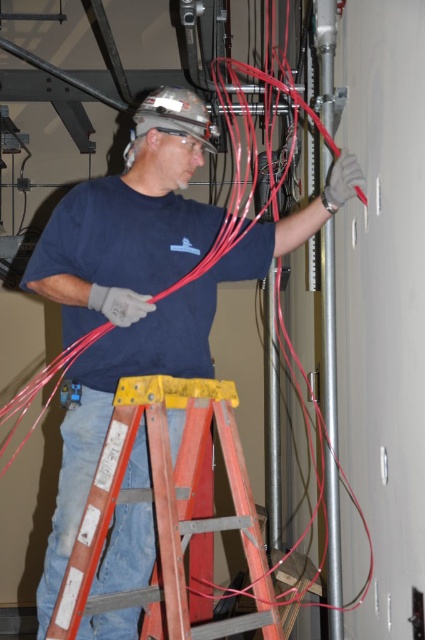
Question: Does matte black shirt at center have a smaller size compared to red wood ladder at center?

Choices:
 (A) yes
 (B) no

Answer: (B)

Question: Does matte black shirt at center come behind red wood ladder at center?

Choices:
 (A) no
 (B) yes

Answer: (B)

Question: Does matte black shirt at center come in front of red wood ladder at center?

Choices:
 (A) no
 (B) yes

Answer: (A)

Question: Which point is farther to the camera?

Choices:
 (A) (237, 500)
 (B) (139, 291)

Answer: (B)